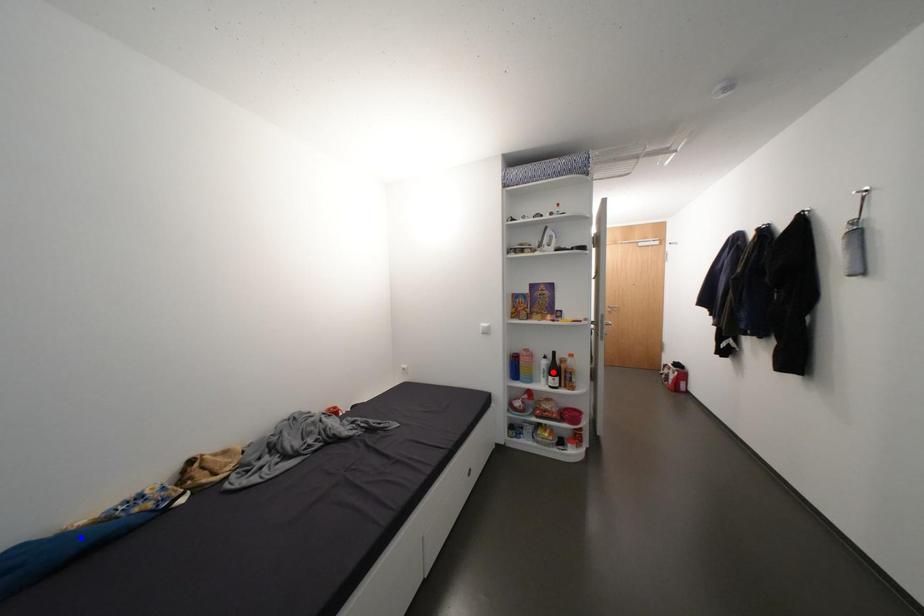
Question: In the image, two points are highlighted. Which point is nearer to the camera? Reply with the corresponding letter.

Choices:
 (A) blue point
 (B) red point

Answer: (A)